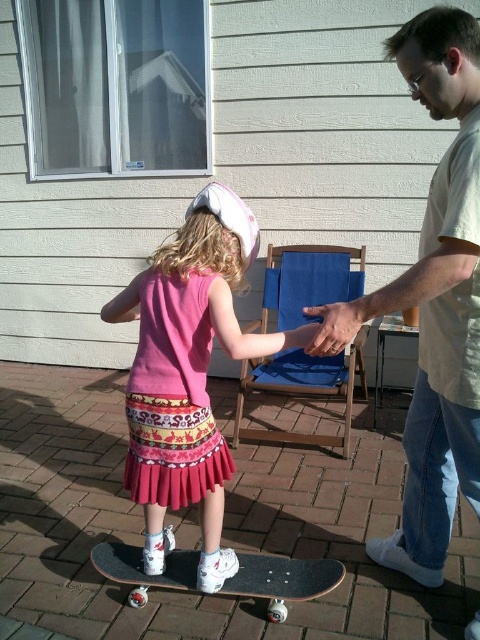
You are a fashion designer observing the image and need to decide which item is wider between the pink fabric skirt at center and the smooth skin hand at center. Which one is wider?

The pink fabric skirt at center is wider than the smooth skin hand at center.

You are a photographer setting up a shot of the light beige shirt at right and the smooth skin hand at center. Which object should you focus on first if you want to capture both in the frame without moving the camera?

The light beige shirt at right is larger in size than the smooth skin hand at center, so you should focus on the light beige shirt at right first to ensure it fits properly in the frame.

You are a photographer trying to capture a closeup of the light beige shirt at right and the smooth skin hand at center. Which object should you zoom in on to ensure it fills the frame more without moving the camera?

The light beige shirt at right is wider than the smooth skin hand at center, so zooming in on the light beige shirt at right will fill the frame more without moving the camera.